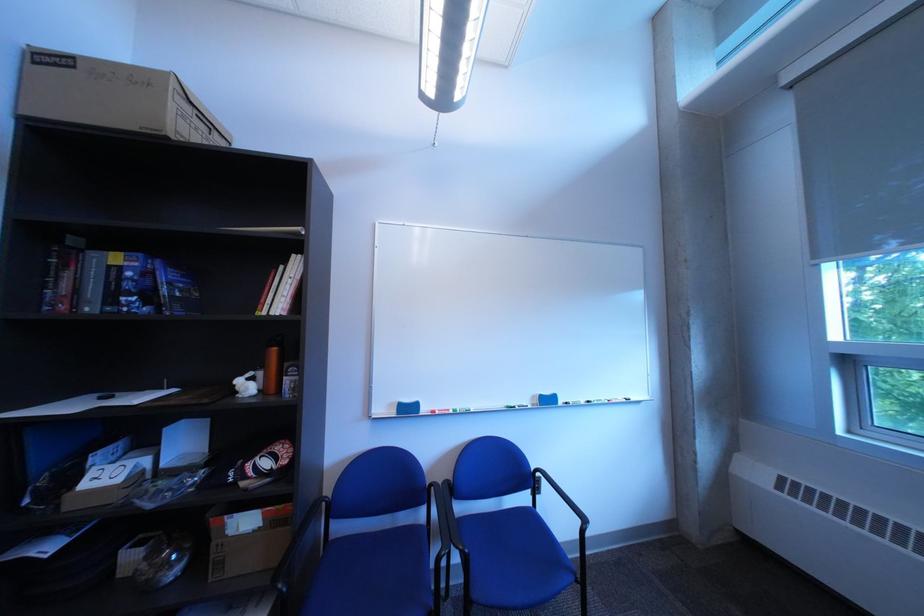
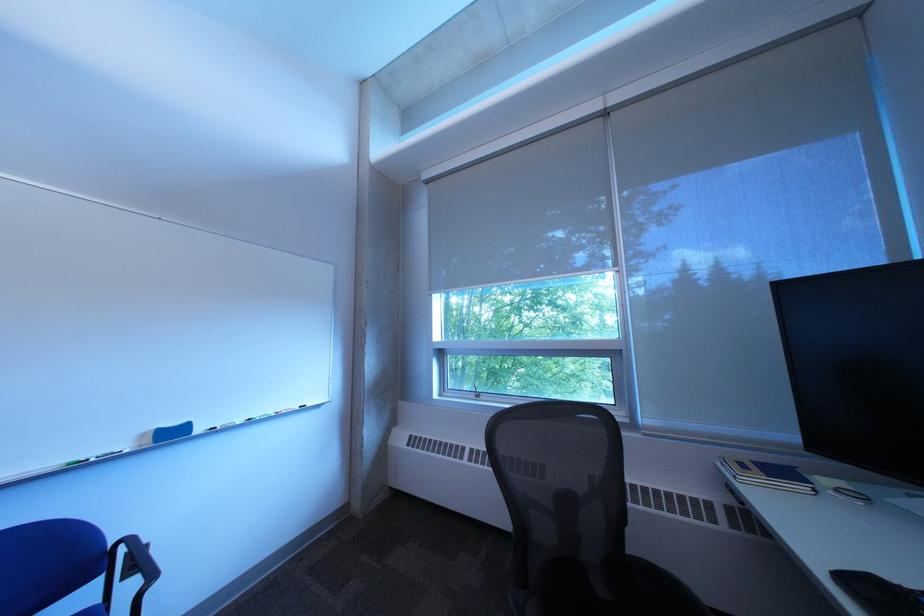
In the second image, find the point that corresponds to pixel 549 399 in the first image.

(159, 437)